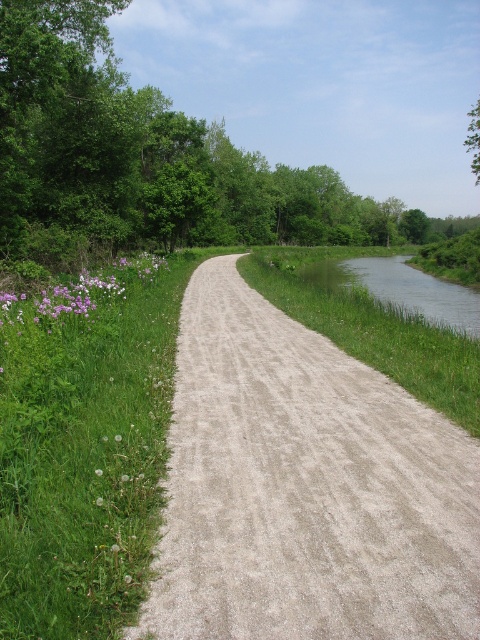
Question: Which point is closer to the camera taking this photo?

Choices:
 (A) (360, 550)
 (B) (467, 129)

Answer: (A)

Question: Is green grass at left below green leafy tree at upper right?

Choices:
 (A) yes
 (B) no

Answer: (A)

Question: Is green grass at left closer to the viewer compared to purple matte flowers at left?

Choices:
 (A) no
 (B) yes

Answer: (B)

Question: Which object is closer to the camera taking this photo?

Choices:
 (A) green leafy tree at upper right
 (B) purple matte flowers at left
 (C) clear water at right

Answer: (B)

Question: Does green grass at left appear on the right side of clear water at right?

Choices:
 (A) yes
 (B) no

Answer: (B)

Question: Which point is farther from the camera taking this photo?

Choices:
 (A) (384, 296)
 (B) (79, 282)
 (C) (228, 451)
 (D) (73, 292)

Answer: (A)